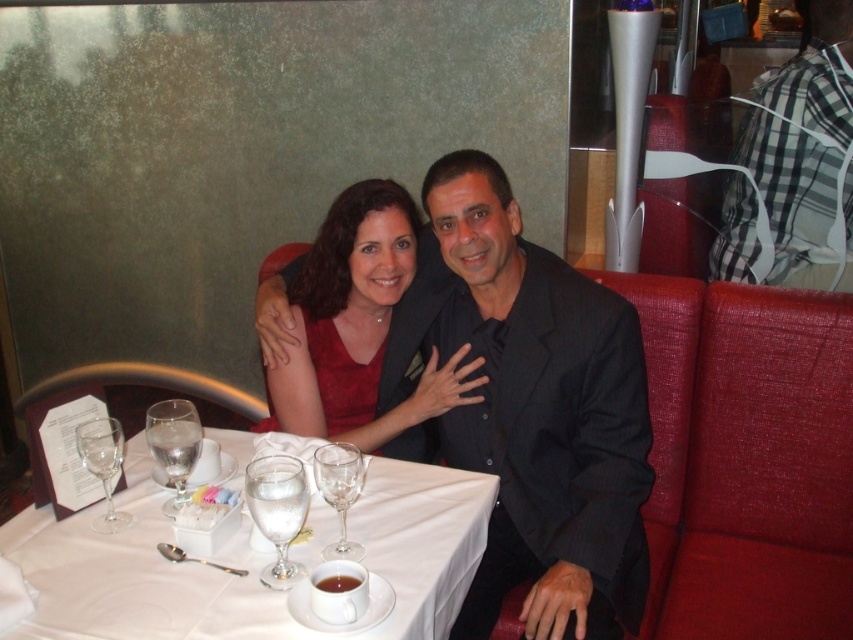
Question: Which point is closer to the camera taking this photo?

Choices:
 (A) (605, 474)
 (B) (199, 449)
 (C) (799, 141)
 (D) (119, 625)

Answer: (D)

Question: Does black pinstripe suit at center have a smaller size compared to clear glass wine glass at table center?

Choices:
 (A) no
 (B) yes

Answer: (A)

Question: Considering the relative positions of white cloth at center and clear glass at table left in the image provided, where is white cloth at center located with respect to clear glass at table left?

Choices:
 (A) below
 (B) above

Answer: (A)

Question: Considering the relative positions of clear glass wine glass at table center and clear glass wine glass at lower left in the image provided, where is clear glass wine glass at table center located with respect to clear glass wine glass at lower left?

Choices:
 (A) right
 (B) left

Answer: (A)

Question: Estimate the real-world distances between objects in this image. Which object is farther from the white cloth at center?

Choices:
 (A) clear glass wine glass at lower left
 (B) matte red dress at center
 (C) checkered fabric shirt at upper right
 (D) black pinstripe suit at center

Answer: (C)

Question: Which object is farther from the camera taking this photo?

Choices:
 (A) clear glass at table left
 (B) checkered fabric shirt at upper right

Answer: (B)